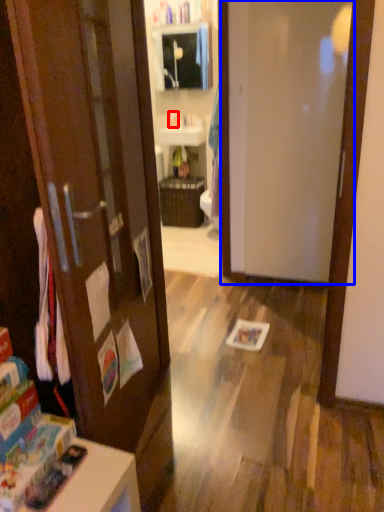
Question: Among these objects, which one is nearest to the camera, toiletry (highlighted by a red box) or door (highlighted by a blue box)?

Choices:
 (A) toiletry
 (B) door

Answer: (B)